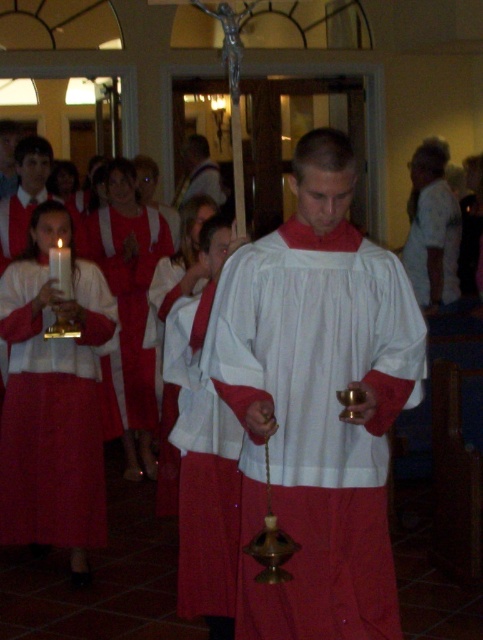
Who is more forward, (383, 579) or (62, 460)?

Point (383, 579) is in front.

Does white matte/soft fabric robe at center have a smaller size compared to matte white robe at left?

No.

In the scene shown: Who is more forward, (x=350, y=330) or (x=14, y=349)?

Point (x=350, y=330) is in front.

Identify the location of white matte/soft fabric robe at center. Image resolution: width=483 pixels, height=640 pixels. (316, 420).

The height and width of the screenshot is (640, 483). In order to click on white matte/soft fabric robe at center in this screenshot , I will do `click(316, 420)`.

Is point (354, 234) positioned in front of point (180, 376)?

That is True.

Identify the location of white matte/soft fabric robe at center. Image resolution: width=483 pixels, height=640 pixels. (316, 420).

Looking at this image, which is below, matte white robe at left or white matte fabric at center?

white matte fabric at center is below.

Is matte white robe at left positioned at the back of white matte fabric at center?

Yes.

Does point (53, 356) come farther from viewer compared to point (198, 548)?

That is True.

Locate an element on the screen. Image resolution: width=483 pixels, height=640 pixels. matte white robe at left is located at coordinates (53, 413).